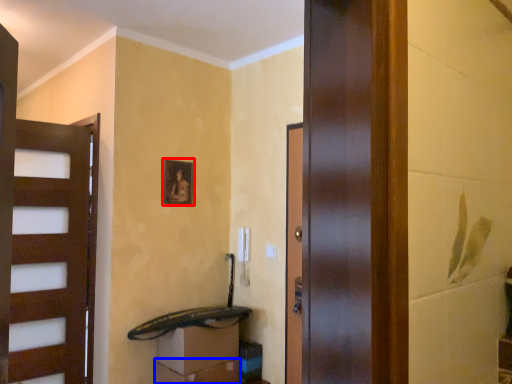
Question: Which object is closer to the camera taking this photo, picture frame (highlighted by a red box) or drawer (highlighted by a blue box)?

Choices:
 (A) picture frame
 (B) drawer

Answer: (B)